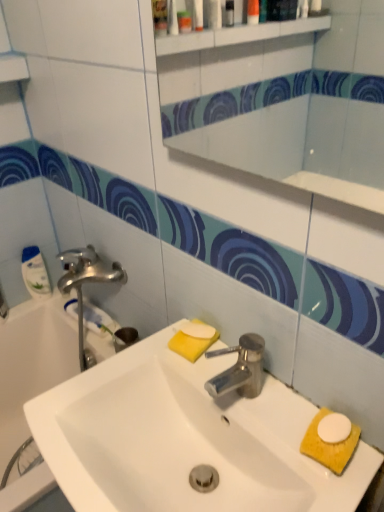
Question: From the image's perspective, is white glossy sink at center above white glossy mirror at upper center?

Choices:
 (A) yes
 (B) no

Answer: (B)

Question: Can you confirm if white glossy sink at center is thinner than white glossy mirror at upper center?

Choices:
 (A) yes
 (B) no

Answer: (B)

Question: Is white glossy sink at center further to camera compared to white glossy mirror at upper center?

Choices:
 (A) no
 (B) yes

Answer: (B)

Question: Is white glossy sink at center taller than white glossy mirror at upper center?

Choices:
 (A) yes
 (B) no

Answer: (B)

Question: Is white glossy sink at center positioned far away from white glossy mirror at upper center?

Choices:
 (A) no
 (B) yes

Answer: (B)

Question: Is yellow sponge at lower right bigger or smaller than white glossy bathtub at left?

Choices:
 (A) small
 (B) big

Answer: (A)

Question: Considering the positions of point (319, 458) and point (105, 346), is point (319, 458) closer or farther from the camera than point (105, 346)?

Choices:
 (A) farther
 (B) closer

Answer: (B)

Question: In terms of width, does yellow sponge at lower right look wider or thinner when compared to white glossy bathtub at left?

Choices:
 (A) thin
 (B) wide

Answer: (A)

Question: Considering their positions, is yellow sponge at lower right located in front of or behind white glossy bathtub at left?

Choices:
 (A) behind
 (B) front

Answer: (B)

Question: Considering the positions of white glossy bathtub at left and white glossy mirror at upper center in the image, is white glossy bathtub at left bigger or smaller than white glossy mirror at upper center?

Choices:
 (A) small
 (B) big

Answer: (B)

Question: Choose the correct answer: Is white glossy bathtub at left inside white glossy mirror at upper center or outside it?

Choices:
 (A) outside
 (B) inside

Answer: (A)

Question: Considering the positions of white glossy bathtub at left and white glossy mirror at upper center in the image, is white glossy bathtub at left taller or shorter than white glossy mirror at upper center?

Choices:
 (A) short
 (B) tall

Answer: (B)

Question: From a real-world perspective, is white glossy bathtub at left physically located above or below white glossy mirror at upper center?

Choices:
 (A) below
 (B) above

Answer: (A)

Question: From the image's perspective, relative to white glossy bottle at left, is white glossy bathtub at left above or below?

Choices:
 (A) above
 (B) below

Answer: (B)

Question: From a real-world perspective, relative to white glossy bottle at left, is white glossy bathtub at left vertically above or below?

Choices:
 (A) below
 (B) above

Answer: (A)